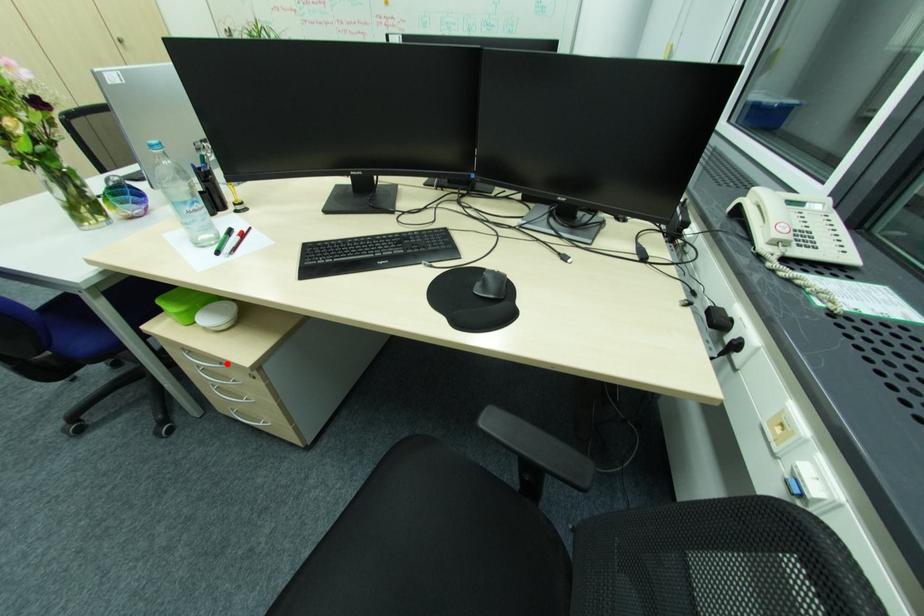
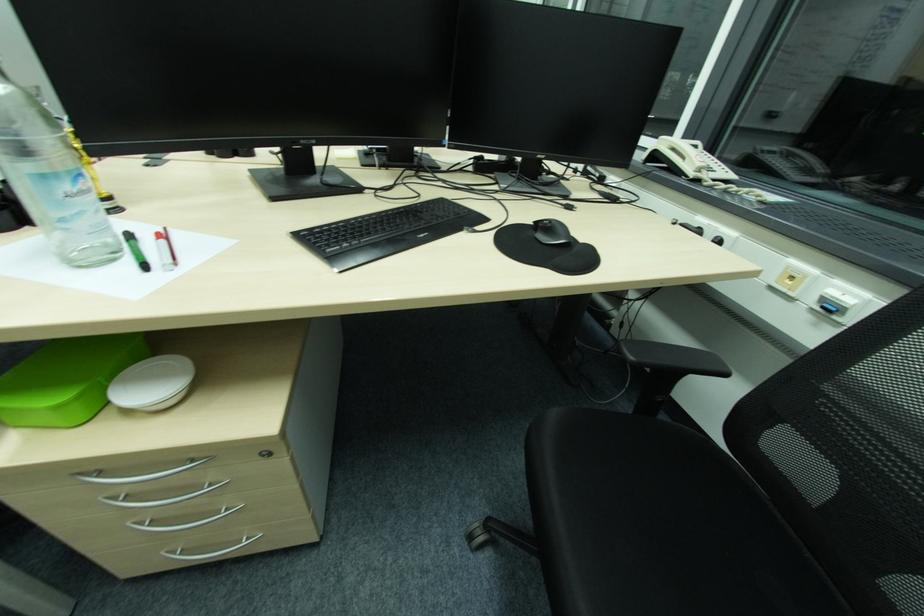
Find the pixel in the second image that matches the highlighted location in the first image.

(199, 460)